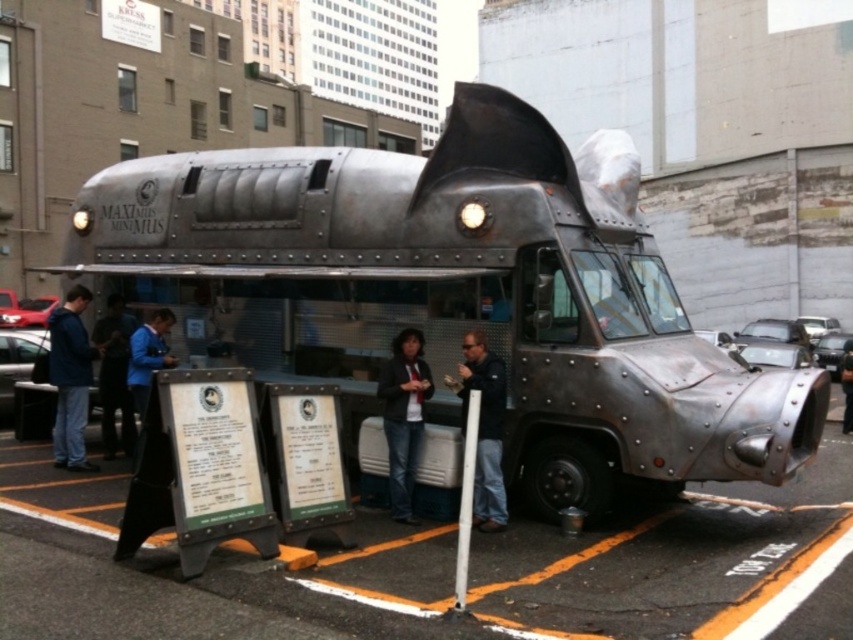
You are a customer standing in front of the MAXIMUS MINIMUS food truck and see the blue denim jacket at left and the white plastic pole at lower center. Which object is closer to you?

The blue denim jacket at left is closer to you because it is further to the viewer than the white plastic pole at lower center.

You are a customer waiting in line at the rustic metal food truck at center. You notice a blue fabric jacket at center nearby. From your position in line, which object is closer to you?

The rustic metal food truck at center is closer to you because it is positioned in front of the blue fabric jacket at center.